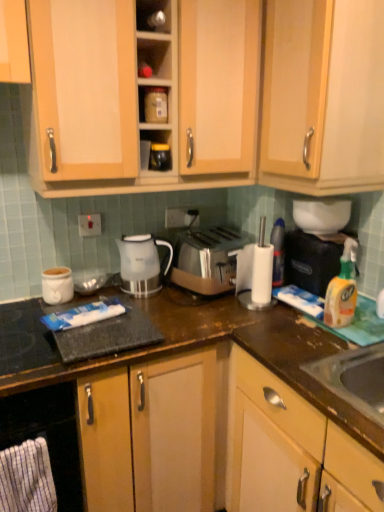
Question: Is metallic silver container at upper center, which is the 2th shelf in bottom-to-top order, taller or shorter than wooden cabinet at upper center, the 1th cabinetry viewed from the top?

Choices:
 (A) tall
 (B) short

Answer: (B)

Question: Does point (158, 3) appear closer or farther from the camera than point (369, 4)?

Choices:
 (A) farther
 (B) closer

Answer: (A)

Question: Which object is the farthest from the white glossy jar at left, the first appliance positioned from the left?

Choices:
 (A) satin silver toaster at center
 (B) white plastic electric outlet at center, placed as the second electric outlet when sorted from front to back
 (C) white plastic blender at center
 (D) white striped cloth at lower left
 (E) white glossy bowl at upper right, acting as the 2th appliance starting from the right

Answer: (E)

Question: Which is nearer to the metallic silver container at upper center, the 1th shelf in the top-to-bottom sequence?

Choices:
 (A) white plastic electric outlet at upper center, the first electric outlet positioned from the left
 (B) satin silver toaster at center
 (C) wooden cabinet at upper center, the 1th cabinetry viewed from the top
 (D) white glossy jar at left, which is counted as the fourth appliance, starting from the right
 (E) white plastic electric outlet at center, marked as the 1th electric outlet in a right-to-left arrangement

Answer: (C)